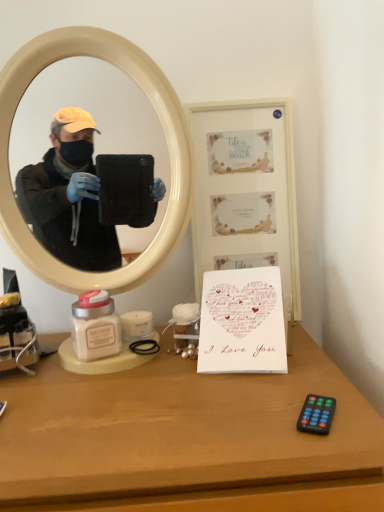
What do you see at coordinates (187, 439) in the screenshot? I see `wooden at lower right` at bounding box center [187, 439].

Locate an element on the screen. This screenshot has width=384, height=512. wooden at lower right is located at coordinates (187, 439).

At what (x,y) coordinates should I click in order to perform the action: click on wooden at lower right. Please return your answer as a coordinate pair (x, y). This screenshot has height=512, width=384. Looking at the image, I should click on (187, 439).